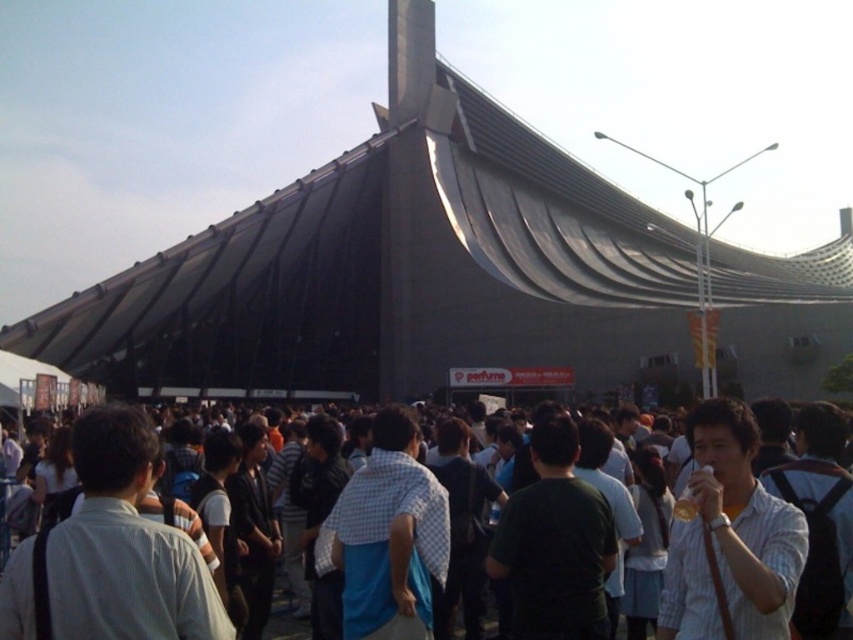
You are standing at the camera position and want to reach the point marked as point [537,566]. If you walk straight ahead, will you reach that point before walking 150 feet?

The distance between the camera and point [537,566] is 153.79 feet, so you will not reach the point before walking 150 feet since it is further away.

You are part of the crowd facing the modern architectural structure. You notice two people in front of you wearing dark casual clothing at center and white striped shirt at center. Which one is positioned more to your left?

The dark casual clothing at center is positioned more to the left compared to the white striped shirt at center.